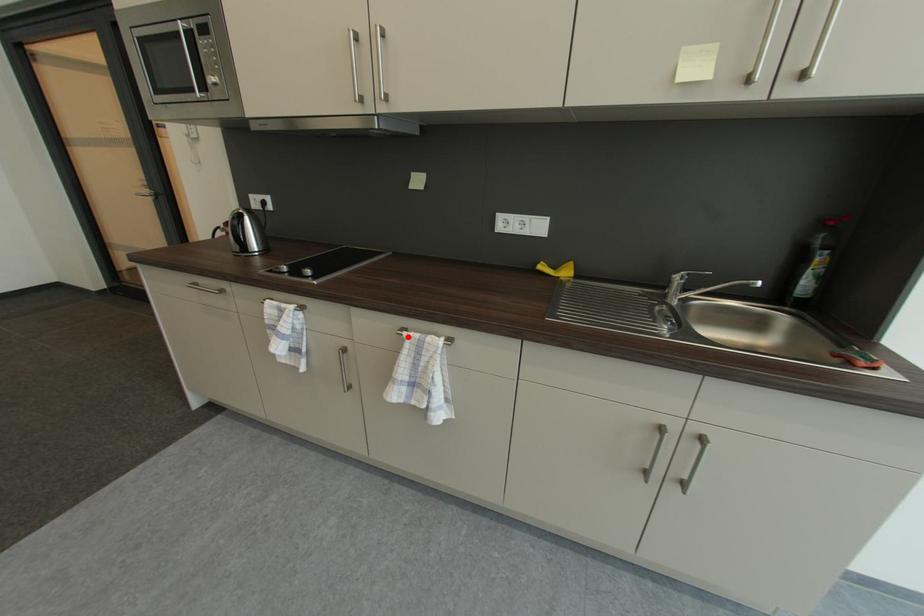
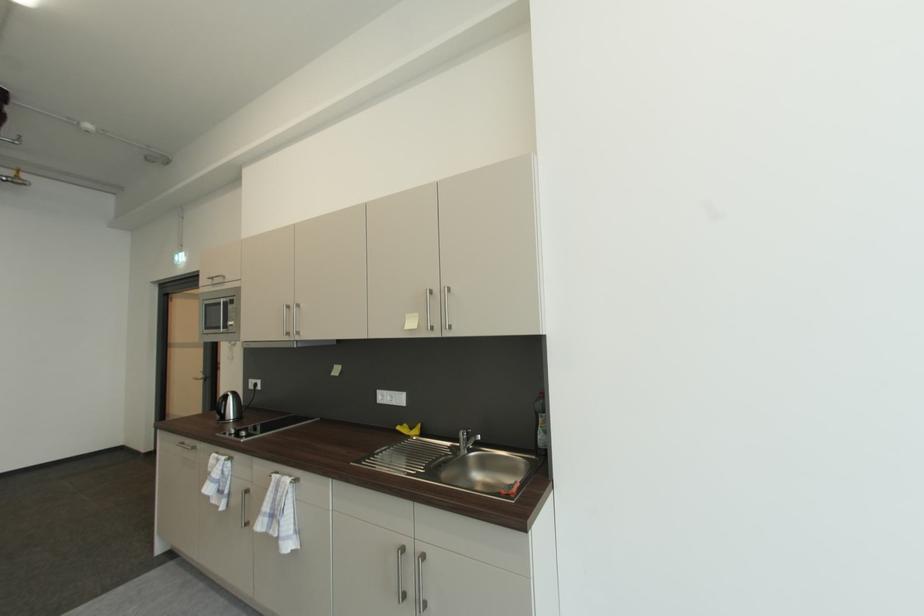
Question: I am providing you with two images of the same scene from different viewpoints. A red point is marked on the first image. Is the red point's position out of view in image 2?

Choices:
 (A) Yes
 (B) No

Answer: (B)